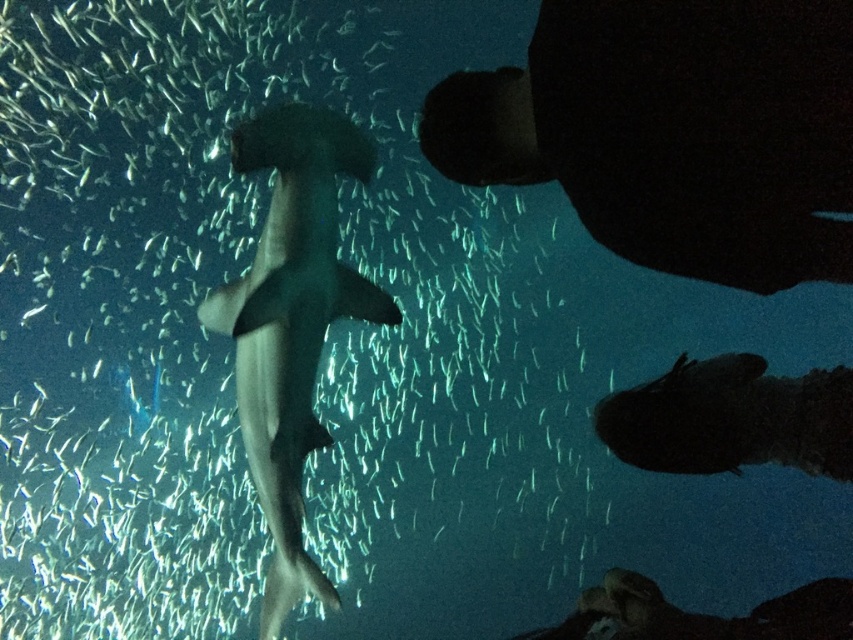
You are a marine biologist observing an underwater scene in an aquarium. You notice a translucent gray shark at center. Where is the shark located in the image?

The translucent gray shark at center is located at point 0.537 on the x axis and 0.272 on the y axis.